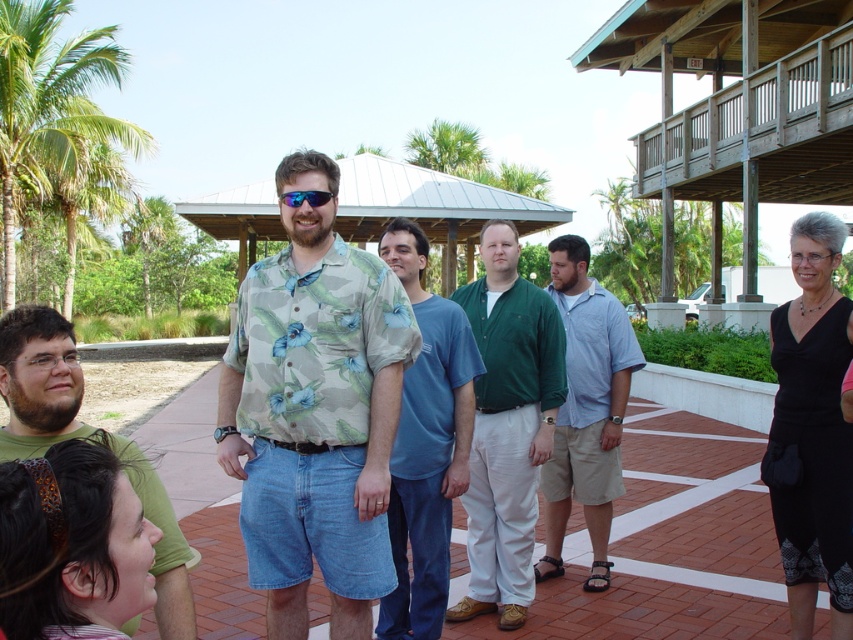
Question: Is floral print shirt at center in front of green cotton shirt at center?

Choices:
 (A) no
 (B) yes

Answer: (B)

Question: Is light blue cotton shirt at center above blue reflective lens sunglasses at center?

Choices:
 (A) yes
 (B) no

Answer: (B)

Question: Which point appears farthest from the camera in this image?

Choices:
 (A) (838, 452)
 (B) (616, 436)

Answer: (B)

Question: Based on their relative distances, which object is farther from the green leafy palm tree at upper left?

Choices:
 (A) floral print shirt at center
 (B) green cotton shirt at lower left
 (C) black matte dress at lower right
 (D) blue reflective lens sunglasses at center

Answer: (D)

Question: Can you confirm if floral print shirt at center is positioned to the right of green cotton shirt at lower left?

Choices:
 (A) no
 (B) yes

Answer: (B)

Question: Which point is farther to the camera?

Choices:
 (A) (412, 244)
 (B) (131, 444)

Answer: (A)